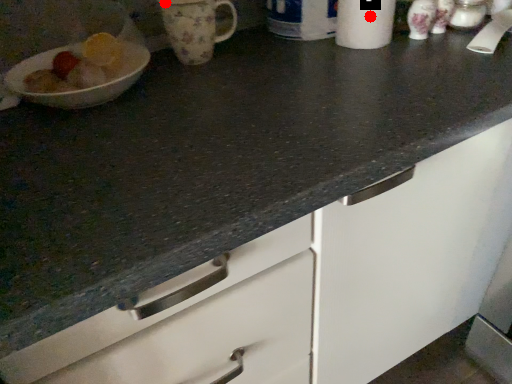
Question: Two points are circled on the image, labeled by A and B beside each circle. Which point appears farthest from the camera in this image?

Choices:
 (A) A is further
 (B) B is further

Answer: (B)